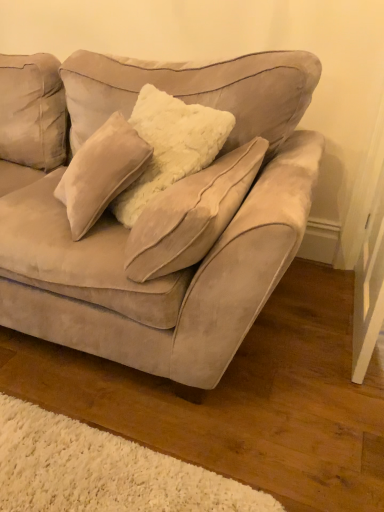
Question: Considering the relative positions of suede couch at center and suede beige pillow at center in the image provided, is suede couch at center in front of suede beige pillow at center?

Choices:
 (A) yes
 (B) no

Answer: (A)

Question: From a real-world perspective, is suede couch at center below suede beige pillow at center?

Choices:
 (A) yes
 (B) no

Answer: (A)

Question: Is suede couch at center smaller than suede beige pillow at center?

Choices:
 (A) no
 (B) yes

Answer: (A)

Question: Would you say suede couch at center contains suede beige pillow at center?

Choices:
 (A) yes
 (B) no

Answer: (A)

Question: Considering the relative positions of suede couch at center and suede beige pillow at center in the image provided, is suede couch at center to the right of suede beige pillow at center from the viewer's perspective?

Choices:
 (A) no
 (B) yes

Answer: (A)

Question: From the image's perspective, would you say suede couch at center is shown under suede beige pillow at center?

Choices:
 (A) no
 (B) yes

Answer: (A)

Question: Considering the relative sizes of suede beige pillow at center and suede couch at center in the image provided, is suede beige pillow at center taller than suede couch at center?

Choices:
 (A) no
 (B) yes

Answer: (A)

Question: From the image's perspective, is suede beige pillow at center under suede couch at center?

Choices:
 (A) no
 (B) yes

Answer: (B)

Question: Is suede beige pillow at center further to the viewer compared to suede couch at center?

Choices:
 (A) no
 (B) yes

Answer: (B)

Question: Can suede couch at center be found inside suede beige pillow at center?

Choices:
 (A) no
 (B) yes

Answer: (A)

Question: Is suede beige pillow at center bigger than suede couch at center?

Choices:
 (A) no
 (B) yes

Answer: (A)

Question: Is suede beige pillow at center closer to camera compared to suede couch at center?

Choices:
 (A) no
 (B) yes

Answer: (A)

Question: In the image, is suede couch at center on the left side or the right side of suede beige pillow at center?

Choices:
 (A) right
 (B) left

Answer: (B)